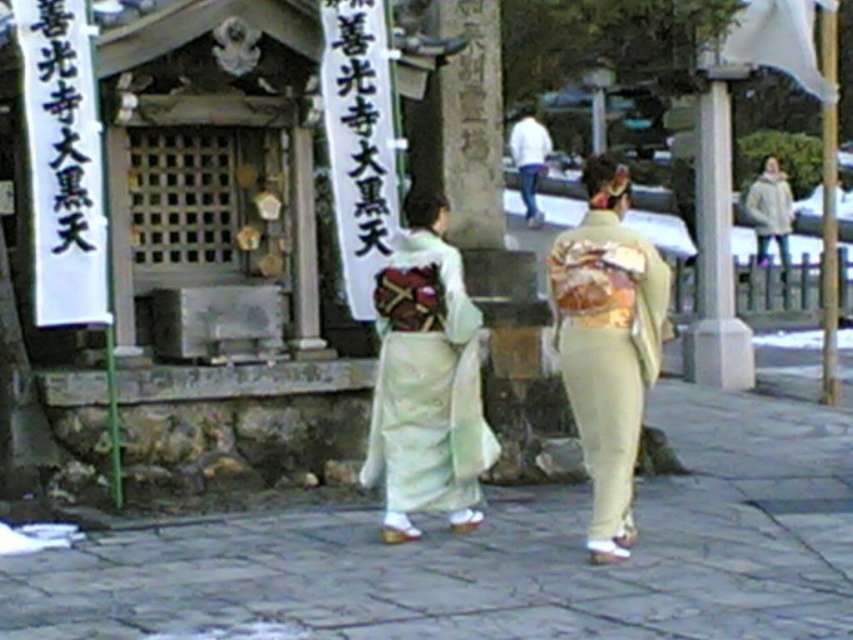
Question: Can you confirm if light beige kimono at center is wider than white cotton jacket at upper right?

Choices:
 (A) yes
 (B) no

Answer: (B)

Question: Which object is farther from the camera taking this photo?

Choices:
 (A) white cotton jacket at upper right
 (B) light gray stone pavement at center
 (C) light beige kimono at center

Answer: (A)

Question: Estimate the real-world distances between objects in this image. Which object is closer to the light gray stone pavement at center?

Choices:
 (A) white cotton jacket at upper right
 (B) light beige kimono at center

Answer: (B)

Question: In this image, where is white silk kimono at center located relative to light beige kimono at center?

Choices:
 (A) right
 (B) left

Answer: (B)

Question: Can you confirm if white silk kimono at center is thinner than white cotton jacket at upper right?

Choices:
 (A) yes
 (B) no

Answer: (A)

Question: Considering the real-world distances, which object is closest to the white silk kimono at center?

Choices:
 (A) light beige kimono at center
 (B) white cotton jacket at upper right
 (C) light gray stone pavement at center

Answer: (A)